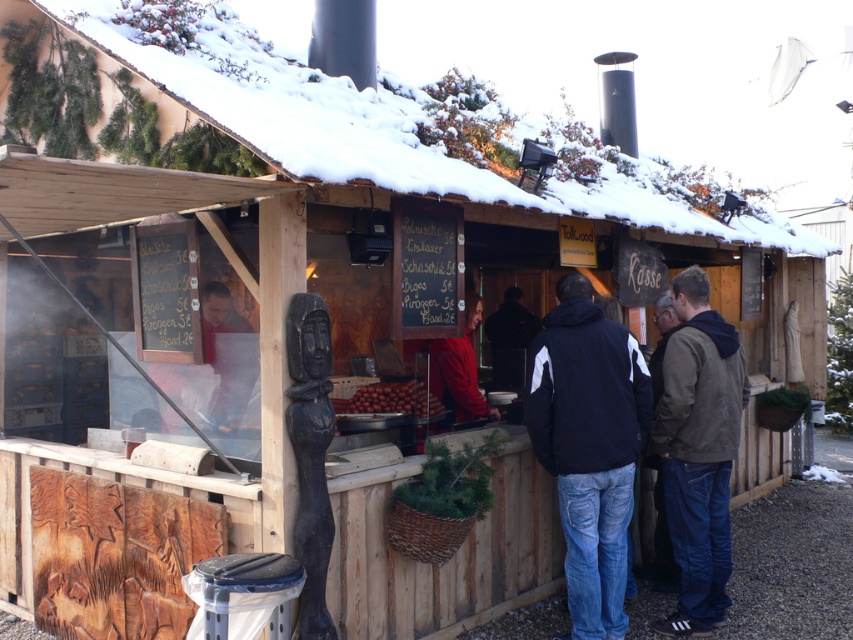
Question: Does black fabric jacket at center appear on the right side of brown matte nuts at center?

Choices:
 (A) no
 (B) yes

Answer: (B)

Question: Observing the image, what is the correct spatial positioning of black fabric jacket at center in reference to brown matte nuts at center?

Choices:
 (A) below
 (B) above

Answer: (A)

Question: Among these points, which one is nearest to the camera?

Choices:
 (A) (360, 392)
 (B) (590, 552)

Answer: (B)

Question: Is brown leather jacket at lower right in front of brown matte nuts at center?

Choices:
 (A) no
 (B) yes

Answer: (B)

Question: Among these objects, which one is farthest from the camera?

Choices:
 (A) brown leather jacket at lower right
 (B) black fabric jacket at center
 (C) brown matte nuts at center

Answer: (C)

Question: Which point is closer to the camera?

Choices:
 (A) (718, 474)
 (B) (618, 577)

Answer: (B)